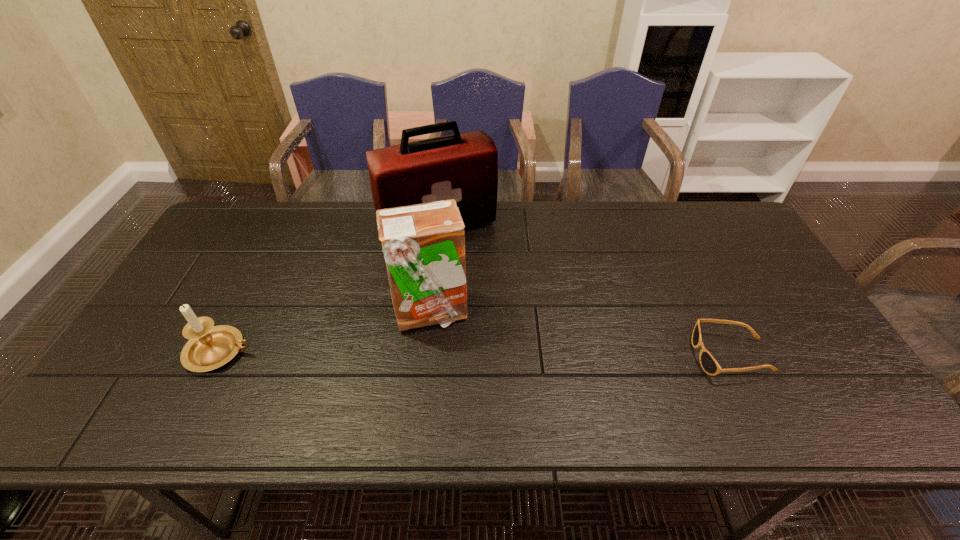
At what (x,y) coordinates should I click in order to perform the action: click on the third tallest object. Please return your answer as a coordinate pair (x, y). The image size is (960, 540). Looking at the image, I should click on (210, 347).

Locate an element on the screen. The width and height of the screenshot is (960, 540). the leftmost object is located at coordinates (210, 347).

This screenshot has width=960, height=540. Find the location of `sunglasses`. sunglasses is located at coordinates (710, 366).

You are a GUI agent. You are given a task and a screenshot of the screen. Output one action in this format:
    pyautogui.click(x=<x>, y=<y>)
    Task: Click on the rightmost object
    The height and width of the screenshot is (540, 960).
    Given the screenshot: What is the action you would take?
    pyautogui.click(x=710, y=366)

What are the coordinates of `carton` in the screenshot? It's located at (423, 244).

In order to click on the farthest object in this screenshot , I will do `click(464, 166)`.

This screenshot has height=540, width=960. What are the coordinates of `free point located with a handle on the side of the third tallest object` in the screenshot? It's located at (322, 352).

Locate an element on the screen. This screenshot has height=540, width=960. vacant space located 0.070m on the front-facing side of the shortest object is located at coordinates (667, 356).

This screenshot has width=960, height=540. I want to click on free space located on the front-facing side of the shortest object, so click(563, 356).

The width and height of the screenshot is (960, 540). Find the location of `vacant space located on the front-facing side of the shortest object`. vacant space located on the front-facing side of the shortest object is located at coordinates (539, 356).